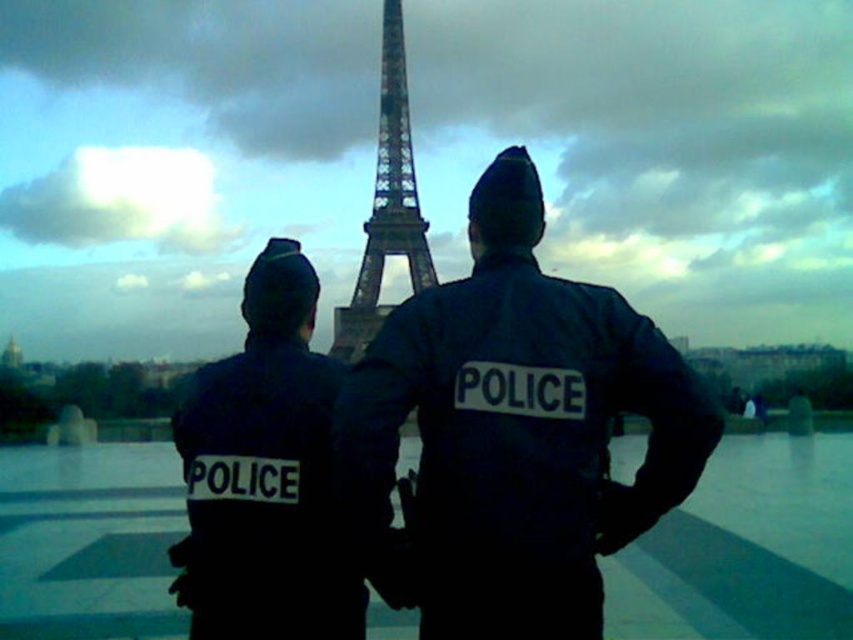
Question: Which point appears closest to the camera in this image?

Choices:
 (A) tap(467, 548)
 (B) tap(413, 195)

Answer: (B)

Question: Does black matte uniform at center appear over metallic lattice structure at center?

Choices:
 (A) no
 (B) yes

Answer: (A)

Question: Considering the real-world distances, which object is farthest from the black matte uniform at center?

Choices:
 (A) metallic lattice structure at center
 (B) dark blue uniform at center

Answer: (A)

Question: Is dark blue uniform at center thinner than black matte uniform at center?

Choices:
 (A) yes
 (B) no

Answer: (B)

Question: Is dark blue uniform at center thinner than metallic lattice structure at center?

Choices:
 (A) yes
 (B) no

Answer: (B)

Question: Estimate the real-world distances between objects in this image. Which object is farther from the metallic lattice structure at center?

Choices:
 (A) black matte uniform at center
 (B) dark blue uniform at center

Answer: (A)